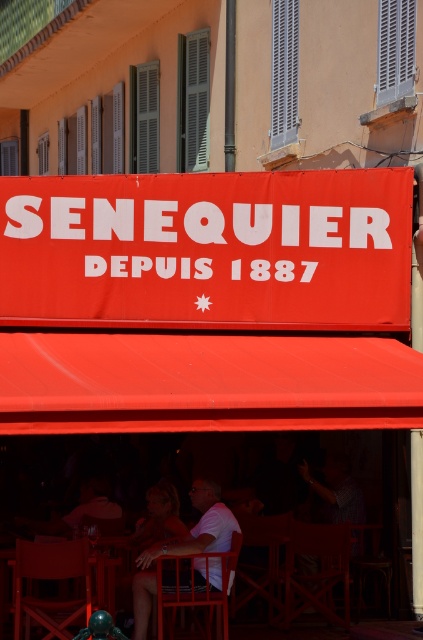
Is point (192, 177) closer to viewer compared to point (74, 508)?

Yes, point (192, 177) is in front of point (74, 508).

This screenshot has width=423, height=640. What do you see at coordinates (208, 250) in the screenshot?
I see `red fabric sign at center` at bounding box center [208, 250].

The height and width of the screenshot is (640, 423). I want to click on red fabric sign at center, so click(x=208, y=250).

Can you confirm if white cotton shirt at center is positioned to the left of matte red shirt at center?

In fact, white cotton shirt at center is to the right of matte red shirt at center.

Between white cotton shirt at center and matte red shirt at center, which one is positioned higher?

Answer: matte red shirt at center is above.

This screenshot has height=640, width=423. Identify the location of white cotton shirt at center. (184, 547).

In the scene shown: Is white cotton shirt at center closer to camera compared to matte white shirt at lower left?

Yes, it is in front of matte white shirt at lower left.

Does white cotton shirt at center appear on the right side of matte white shirt at lower left?

Answer: Correct, you'll find white cotton shirt at center to the right of matte white shirt at lower left.

Which is in front, point (192, 552) or point (93, 490)?

Point (192, 552) is in front.

You are a GUI agent. You are given a task and a screenshot of the screen. Output one action in this format:
    pyautogui.click(x=<x>, y=<y>)
    Task: Click on the white cotton shirt at center
    
    Given the screenshot: What is the action you would take?
    pyautogui.click(x=184, y=547)